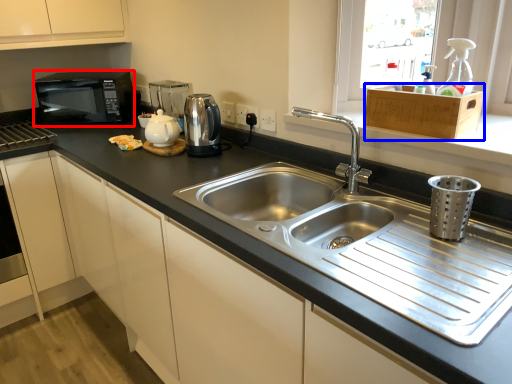
Question: Which object is further to the camera taking this photo, microwave oven (highlighted by a red box) or cabinetry (highlighted by a blue box)?

Choices:
 (A) microwave oven
 (B) cabinetry

Answer: (A)